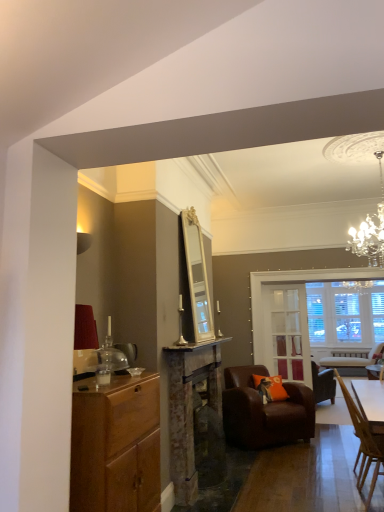
This screenshot has height=512, width=384. What are the coordinates of `orange fabric pillow at center` in the screenshot? It's located at (271, 387).

This screenshot has width=384, height=512. What do you see at coordinates (362, 443) in the screenshot?
I see `wooden chair at lower right, placed as the second chair when sorted from back to front` at bounding box center [362, 443].

What is the approximate width of brown leather armchair at center, which is the 1th chair in back-to-front order?

36.26 inches.

Identify the location of clear glass door at center. The width and height of the screenshot is (384, 512). (287, 332).

Is rusty metal fireplace at center inside the boundaries of brown leather armchair at center, which is the second chair from front to back, or outside?

rusty metal fireplace at center lies outside brown leather armchair at center, which is the second chair from front to back.

How far apart are rusty metal fireplace at center and brown leather armchair at center, which is the second chair from front to back?

rusty metal fireplace at center is 69.74 centimeters away from brown leather armchair at center, which is the second chair from front to back.

Is brown leather armchair at center, which is the 1th chair in back-to-front order, at the back of rusty metal fireplace at center?

No.

Considering the relative sizes of rusty metal fireplace at center and brown leather armchair at center, which is the second chair from front to back, in the image provided, is rusty metal fireplace at center taller than brown leather armchair at center, which is the second chair from front to back,?

Yes.

Image resolution: width=384 pixels, height=512 pixels. Find the location of `glass door above the wooden cabinet at left (from a real-world perspective)`. glass door above the wooden cabinet at left (from a real-world perspective) is located at coordinates (287, 332).

Could you tell me if clear glass door at center is turned towards wooden cabinet at left?

Yes.

Which is behind, point (302, 289) or point (154, 506)?

The point (302, 289) is farther from the camera.

Can you confirm if orange fabric pillow at center is thinner than rusty metal fireplace at center?

No, orange fabric pillow at center is not thinner than rusty metal fireplace at center.

Considering the sizes of objects orange fabric pillow at center and rusty metal fireplace at center in the image provided, who is bigger, orange fabric pillow at center or rusty metal fireplace at center?

With larger size is rusty metal fireplace at center.

From a real-world perspective, is orange fabric pillow at center positioned above or below rusty metal fireplace at center?

From a real-world perspective, orange fabric pillow at center is physically below rusty metal fireplace at center.

From a real-world perspective, which is physically above, wooden chair at lower right, which appears as the 1th chair when viewed from the front, or wooden cabinet at left?

wooden cabinet at left.

Which is more to the right, wooden chair at lower right, which appears as the 1th chair when viewed from the front, or wooden cabinet at left?

From the viewer's perspective, wooden chair at lower right, which appears as the 1th chair when viewed from the front, appears more on the right side.

Between wooden chair at lower right, which appears as the 1th chair when viewed from the front, and wooden cabinet at left, which one has less height?

wooden cabinet at left.

Looking at this image, is rusty metal fireplace at center completely or partially inside wooden chair at lower right, placed as the second chair when sorted from back to front?

Actually, rusty metal fireplace at center is outside wooden chair at lower right, placed as the second chair when sorted from back to front.

Based on the photo, how far apart are wooden chair at lower right, placed as the second chair when sorted from back to front, and rusty metal fireplace at center?

A distance of 4.52 feet exists between wooden chair at lower right, placed as the second chair when sorted from back to front, and rusty metal fireplace at center.

Where is `fireplace that is on the left side of wooden chair at lower right, which appears as the 1th chair when viewed from the front`? This screenshot has height=512, width=384. fireplace that is on the left side of wooden chair at lower right, which appears as the 1th chair when viewed from the front is located at coordinates (189, 407).

Between point (354, 428) and point (182, 350), which one is positioned in front?

The point (354, 428) is closer to the camera.

Is clear glass door at center far from wooden chair at lower right, which appears as the 1th chair when viewed from the front?

Yes, clear glass door at center and wooden chair at lower right, which appears as the 1th chair when viewed from the front, are located far from each other.

From the image's perspective, would you say clear glass door at center is positioned over wooden chair at lower right, which appears as the 1th chair when viewed from the front?

Correct, clear glass door at center appears higher than wooden chair at lower right, which appears as the 1th chair when viewed from the front, in the image.

Is clear glass door at center not inside wooden chair at lower right, which appears as the 1th chair when viewed from the front?

Yes, clear glass door at center is located beyond the bounds of wooden chair at lower right, which appears as the 1th chair when viewed from the front.

Is the surface of brown leather armchair at center, which is the 1th chair in back-to-front order, in direct contact with wooden cabinet at left?

brown leather armchair at center, which is the 1th chair in back-to-front order, is not next to wooden cabinet at left, and they're not touching.

From a real-world perspective, is brown leather armchair at center, which is the 1th chair in back-to-front order, located higher than wooden cabinet at left?

No, from a real-world perspective, brown leather armchair at center, which is the 1th chair in back-to-front order, is not over wooden cabinet at left

Between brown leather armchair at center, which is the 1th chair in back-to-front order, and wooden cabinet at left, which one has more height?

Standing taller between the two is wooden cabinet at left.

Does brown leather armchair at center, which is the 1th chair in back-to-front order, come behind wooden cabinet at left?

That is True.

You are a GUI agent. You are given a task and a screenshot of the screen. Output one action in this format:
    pyautogui.click(x=<x>, y=<y>)
    Task: Click on the fireplace on the left side of brown leather armchair at center, which is the second chair from front to back
    Image resolution: width=384 pixels, height=512 pixels.
    Given the screenshot: What is the action you would take?
    pyautogui.click(x=189, y=407)

Image resolution: width=384 pixels, height=512 pixels. I want to click on glass door above the wooden cabinet at left (from a real-world perspective), so click(287, 332).

Based on their spatial positions, is wooden chair at lower right, placed as the second chair when sorted from back to front, or brown leather armchair at center, which is the second chair from front to back, closer to wooden cabinet at left?

wooden chair at lower right, placed as the second chair when sorted from back to front, is positioned closer to the anchor wooden cabinet at left.

Based on their spatial positions, is wooden chair at lower right, placed as the second chair when sorted from back to front, or clear glass door at center further from rusty metal fireplace at center?

Among the two, clear glass door at center is located further to rusty metal fireplace at center.

From the image, which object appears to be nearer to brown leather armchair at center, which is the second chair from front to back, wooden cabinet at left or clear glass door at center?

clear glass door at center lies closer to brown leather armchair at center, which is the second chair from front to back, than the other object.

From the image, which object appears to be nearer to wooden chair at lower right, placed as the second chair when sorted from back to front, brown leather armchair at center, which is the 1th chair in back-to-front order, or wooden cabinet at left?

Among the two, brown leather armchair at center, which is the 1th chair in back-to-front order, is located nearer to wooden chair at lower right, placed as the second chair when sorted from back to front.

Estimate the real-world distances between objects in this image. Which object is further from wooden chair at lower right, which appears as the 1th chair when viewed from the front, clear glass door at center or rusty metal fireplace at center?

clear glass door at center is positioned further to the anchor wooden chair at lower right, which appears as the 1th chair when viewed from the front.

When comparing their distances from wooden cabinet at left, does wooden chair at lower right, which appears as the 1th chair when viewed from the front, or rusty metal fireplace at center seem closer?

Based on the image, rusty metal fireplace at center appears to be nearer to wooden cabinet at left.

From the image, which object appears to be nearer to rusty metal fireplace at center, orange fabric pillow at center or wooden cabinet at left?

Based on the image, wooden cabinet at left appears to be nearer to rusty metal fireplace at center.

From the picture: Considering their positions, is orange fabric pillow at center positioned closer to wooden chair at lower right, which appears as the 1th chair when viewed from the front, than rusty metal fireplace at center?

rusty metal fireplace at center.

You are a GUI agent. You are given a task and a screenshot of the screen. Output one action in this format:
    pyautogui.click(x=<x>, y=<y>)
    Task: Click on the fireplace located between wooden cabinet at left and clear glass door at center in the depth direction
    The height and width of the screenshot is (512, 384).
    Given the screenshot: What is the action you would take?
    pyautogui.click(x=189, y=407)

In order to click on chair between wooden cabinet at left and brown leather armchair at center, which is the second chair from front to back, in the front-back direction in this screenshot , I will do coord(362,443).

Locate an element on the screen. The image size is (384, 512). fireplace located between wooden chair at lower right, which appears as the 1th chair when viewed from the front, and orange fabric pillow at center in the depth direction is located at coordinates (189, 407).

Identify the location of pillow positioned between rusty metal fireplace at center and clear glass door at center from near to far. The width and height of the screenshot is (384, 512). (271, 387).